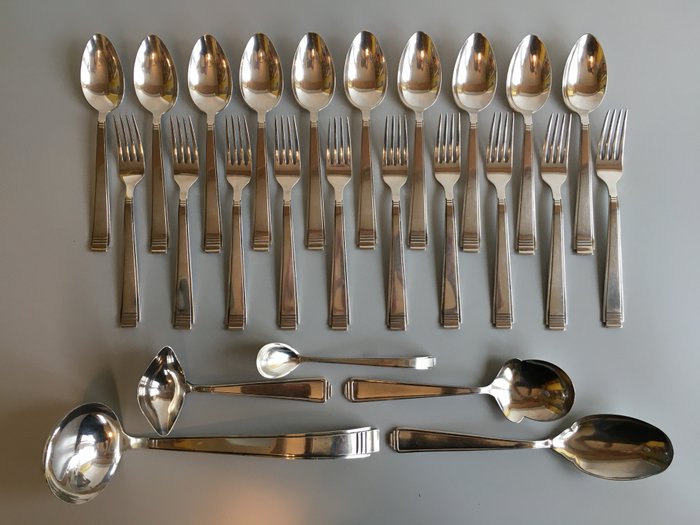
You are a GUI agent. You are given a task and a screenshot of the screen. Output one action in this format:
    pyautogui.click(x=<x>, y=<y>)
    Task: Click on the forks
    The width and height of the screenshot is (700, 525).
    Given the screenshot: What is the action you would take?
    pyautogui.click(x=131, y=170), pyautogui.click(x=182, y=168), pyautogui.click(x=239, y=168), pyautogui.click(x=286, y=166), pyautogui.click(x=335, y=166), pyautogui.click(x=395, y=169), pyautogui.click(x=449, y=169), pyautogui.click(x=494, y=170), pyautogui.click(x=556, y=170), pyautogui.click(x=603, y=170)